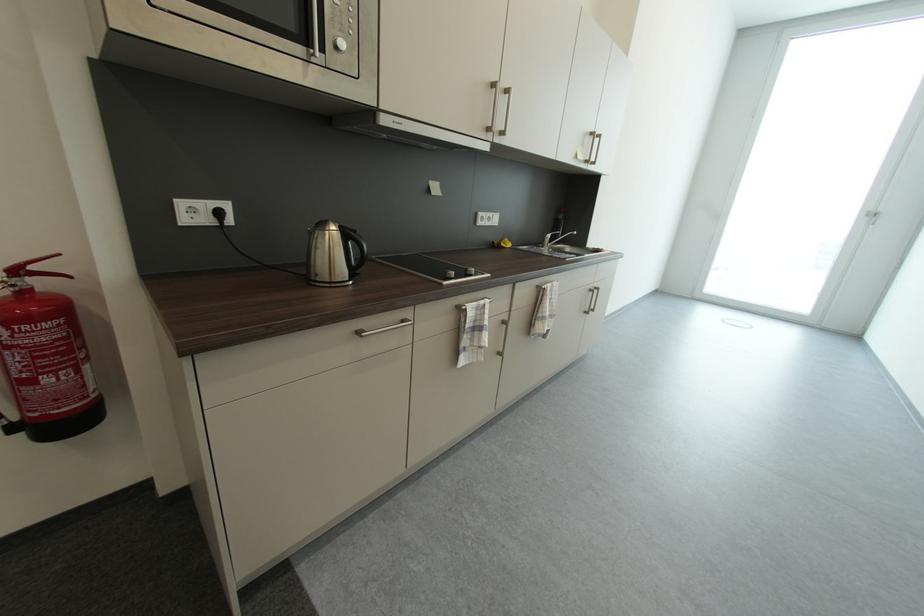
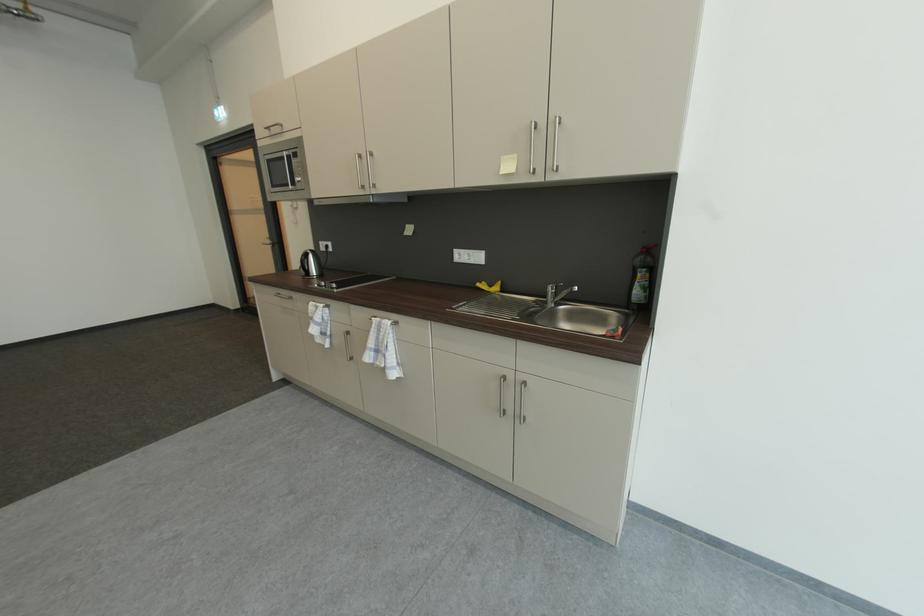
Locate, in the second image, the point that corresponds to [569,212] in the first image.

(650, 252)